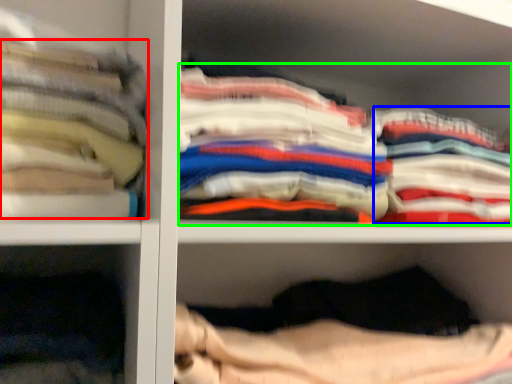
Question: Considering the real-world distances, which object is farthest from clothing (highlighted by a red box)? clothing (highlighted by a blue box) or clothing (highlighted by a green box)?

Choices:
 (A) clothing
 (B) clothing

Answer: (A)